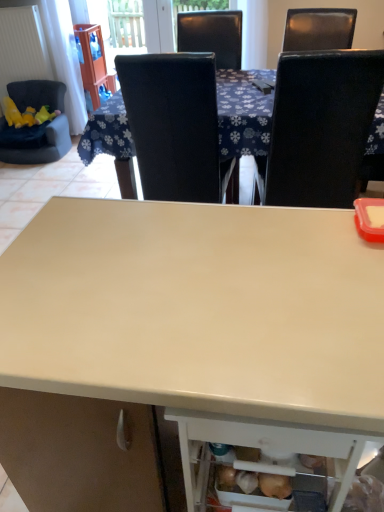
Identify the location of white glossy table at center. The width and height of the screenshot is (384, 512). pyautogui.click(x=244, y=116).

Find the location of `white glossy table at center`. white glossy table at center is located at coordinates (244, 116).

Is point (362, 343) positioned behind point (376, 144)?

No, it is in front of (376, 144).

Is matte white desk at center oriented towards white glossy table at center?

No.

In the scene shown: Considering the relative sizes of matte white desk at center and white glossy table at center in the image provided, is matte white desk at center wider than white glossy table at center?

No, matte white desk at center is not wider than white glossy table at center.

Which of these two, matte white desk at center or white glossy table at center, is bigger?

With larger size is white glossy table at center.

At what (x,y) coordinates should I click in order to perform the action: click on chair behind the white glossy table at center. Please return your answer as a coordinate pair (x, y). This screenshot has width=384, height=512. Looking at the image, I should click on (48, 123).

Considering the sizes of objects white glossy table at center and velvet dark blue chair at left, positioned as the first chair in left-to-right order, in the image provided, who is shorter, white glossy table at center or velvet dark blue chair at left, positioned as the first chair in left-to-right order,?

With less height is velvet dark blue chair at left, positioned as the first chair in left-to-right order.

From the image's perspective, is white glossy table at center located beneath velvet dark blue chair at left, positioned as the first chair in left-to-right order?

Correct, white glossy table at center appears lower than velvet dark blue chair at left, positioned as the first chair in left-to-right order, in the image.

Would you say white glossy table at center contains velvet dark blue chair at left, arranged as the 3th chair when viewed from the right?

No.

In the scene shown: Is velvet dark blue chair at left, positioned as the first chair in left-to-right order, positioned with its back to black leather chair at upper center, which ranks as the 2th chair in right-to-left order?

No, velvet dark blue chair at left, positioned as the first chair in left-to-right order, is not facing away from black leather chair at upper center, which ranks as the 2th chair in right-to-left order.

Who is bigger, velvet dark blue chair at left, positioned as the first chair in left-to-right order, or black leather chair at upper center, the 2th chair positioned from the left?

black leather chair at upper center, the 2th chair positioned from the left.

Considering the sizes of velvet dark blue chair at left, arranged as the 3th chair when viewed from the right, and black leather chair at upper center, the 2th chair positioned from the left, in the image, is velvet dark blue chair at left, arranged as the 3th chair when viewed from the right, taller or shorter than black leather chair at upper center, the 2th chair positioned from the left,?

In the image, velvet dark blue chair at left, arranged as the 3th chair when viewed from the right, appears to be shorter than black leather chair at upper center, the 2th chair positioned from the left.

What's the angular difference between black leather chair at upper center, the 2th chair positioned from the left, and black leather chair at upper right, the 3th chair positioned from the left,'s facing directions?

6.21 degrees separate the facing orientations of black leather chair at upper center, the 2th chair positioned from the left, and black leather chair at upper right, the 3th chair positioned from the left.

Between black leather chair at upper center, which ranks as the 2th chair in right-to-left order, and black leather chair at upper right, the 1th chair when ordered from right to left, which one has less height?

black leather chair at upper center, which ranks as the 2th chair in right-to-left order, is shorter.

Is black leather chair at upper center, which ranks as the 2th chair in right-to-left order, inside or outside of black leather chair at upper right, the 3th chair positioned from the left?

black leather chair at upper center, which ranks as the 2th chair in right-to-left order, is not inside black leather chair at upper right, the 3th chair positioned from the left, it's outside.

Looking at this image, who is smaller, black leather chair at upper center, which ranks as the 2th chair in right-to-left order, or black leather chair at upper right, the 1th chair when ordered from right to left?

black leather chair at upper center, which ranks as the 2th chair in right-to-left order.

Which chair is the 2nd one when counting from the left side of the black leather chair at upper right, the 3th chair positioned from the left? Please provide its 2D coordinates.

[(48, 123)]

How different are the orientations of velvet dark blue chair at left, positioned as the first chair in left-to-right order, and black leather chair at upper right, the 1th chair when ordered from right to left, in degrees?

179 degrees separate the facing orientations of velvet dark blue chair at left, positioned as the first chair in left-to-right order, and black leather chair at upper right, the 1th chair when ordered from right to left.

From the image's perspective, does velvet dark blue chair at left, arranged as the 3th chair when viewed from the right, appear lower than black leather chair at upper right, the 3th chair positioned from the left?

Incorrect, from the image's perspective, velvet dark blue chair at left, arranged as the 3th chair when viewed from the right, is higher than black leather chair at upper right, the 3th chair positioned from the left.

Which is behind, matte white desk at center or black leather chair at upper right, the 3th chair positioned from the left?

black leather chair at upper right, the 3th chair positioned from the left, is further away from the camera.

From a real-world perspective, is matte white desk at center positioned above or below black leather chair at upper right, the 1th chair when ordered from right to left?

Clearly, from a real-world perspective, matte white desk at center is below black leather chair at upper right, the 1th chair when ordered from right to left.

Who is taller, matte white desk at center or black leather chair at upper right, the 1th chair when ordered from right to left?

black leather chair at upper right, the 1th chair when ordered from right to left.

Would you say black leather chair at upper right, the 3th chair positioned from the left, is part of matte white desk at center's contents?

No, black leather chair at upper right, the 3th chair positioned from the left, is not surrounded by matte white desk at center.

From a real-world perspective, is black leather chair at upper right, the 1th chair when ordered from right to left, on white glossy table at center?

Correct, in the physical world, black leather chair at upper right, the 1th chair when ordered from right to left, is higher than white glossy table at center.

In the scene shown: Can you tell me how much black leather chair at upper right, the 1th chair when ordered from right to left, and white glossy table at center differ in facing direction?

There is a 83.9-degree angle between the facing directions of black leather chair at upper right, the 1th chair when ordered from right to left, and white glossy table at center.

Is black leather chair at upper right, the 1th chair when ordered from right to left, to the left of white glossy table at center from the viewer's perspective?

No.

Consider the image. Is black leather chair at upper right, the 3th chair positioned from the left, taller than white glossy table at center?

Correct, black leather chair at upper right, the 3th chair positioned from the left, is much taller as white glossy table at center.

I want to click on table behind the matte white desk at center, so click(x=244, y=116).

From the white glossy table at center, count the 2nd chair to the left and point to it. Please provide its 2D coordinates.

[(48, 123)]

Looking at the image, which one is located further to velvet dark blue chair at left, arranged as the 3th chair when viewed from the right, black leather chair at upper right, the 1th chair when ordered from right to left, or white glossy table at center?

black leather chair at upper right, the 1th chair when ordered from right to left, is further to velvet dark blue chair at left, arranged as the 3th chair when viewed from the right.

Which object lies further to the anchor point black leather chair at upper right, the 1th chair when ordered from right to left, velvet dark blue chair at left, arranged as the 3th chair when viewed from the right, or white glossy table at center?

The object further to black leather chair at upper right, the 1th chair when ordered from right to left, is velvet dark blue chair at left, arranged as the 3th chair when viewed from the right.

Estimate the real-world distances between objects in this image. Which object is further from white glossy table at center, black leather chair at upper right, the 1th chair when ordered from right to left, or black leather chair at upper center, the 2th chair positioned from the left?

black leather chair at upper right, the 1th chair when ordered from right to left, is positioned further to the anchor white glossy table at center.

Which object lies nearer to the anchor point velvet dark blue chair at left, positioned as the first chair in left-to-right order, matte white desk at center or white glossy table at center?

Among the two, white glossy table at center is located nearer to velvet dark blue chair at left, positioned as the first chair in left-to-right order.

Which object lies further to the anchor point black leather chair at upper right, the 3th chair positioned from the left, black leather chair at upper center, the 2th chair positioned from the left, or white glossy table at center?

black leather chair at upper center, the 2th chair positioned from the left, is further to black leather chair at upper right, the 3th chair positioned from the left.

When comparing their distances from black leather chair at upper center, the 2th chair positioned from the left, does white glossy table at center or black leather chair at upper right, the 1th chair when ordered from right to left, seem further?

Among the two, black leather chair at upper right, the 1th chair when ordered from right to left, is located further to black leather chair at upper center, the 2th chair positioned from the left.

Considering their positions, is black leather chair at upper right, the 3th chair positioned from the left, positioned further to matte white desk at center than white glossy table at center?

white glossy table at center lies further to matte white desk at center than the other object.

Estimate the real-world distances between objects in this image. Which object is closer to black leather chair at upper right, the 1th chair when ordered from right to left, matte white desk at center or white glossy table at center?

The object closer to black leather chair at upper right, the 1th chair when ordered from right to left, is white glossy table at center.

Where is `chair located between matte white desk at center and black leather chair at upper center, which ranks as the 2th chair in right-to-left order, in the depth direction`? This screenshot has width=384, height=512. chair located between matte white desk at center and black leather chair at upper center, which ranks as the 2th chair in right-to-left order, in the depth direction is located at coordinates (320, 106).

The width and height of the screenshot is (384, 512). I want to click on table between matte white desk at center and velvet dark blue chair at left, arranged as the 3th chair when viewed from the right, in the front-back direction, so click(x=244, y=116).

Where is `chair between velvet dark blue chair at left, arranged as the 3th chair when viewed from the right, and white glossy table at center, in the horizontal direction`? chair between velvet dark blue chair at left, arranged as the 3th chair when viewed from the right, and white glossy table at center, in the horizontal direction is located at coordinates (174, 125).

What are the coordinates of `table located between black leather chair at upper center, which ranks as the 2th chair in right-to-left order, and black leather chair at upper right, the 3th chair positioned from the left, in the left-right direction` in the screenshot? It's located at click(244, 116).